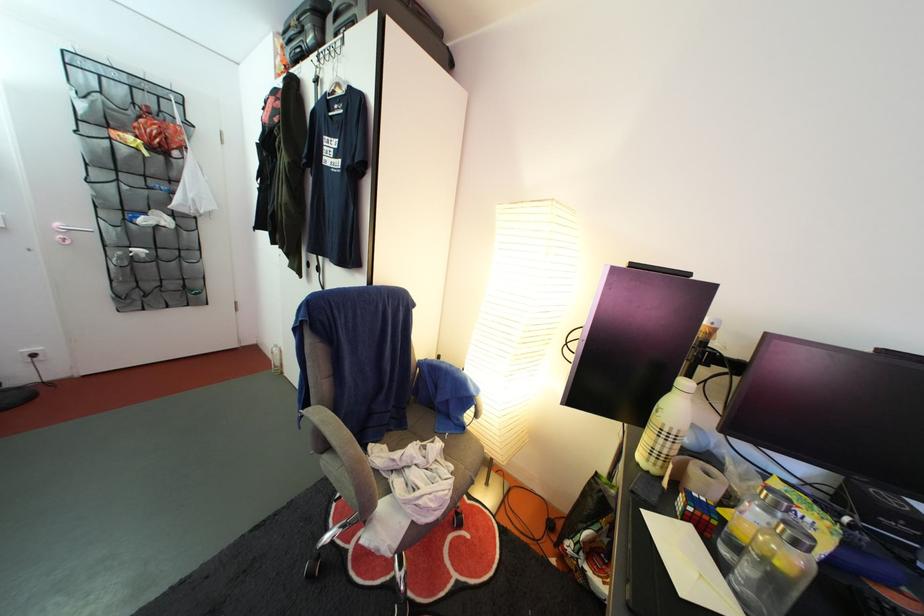
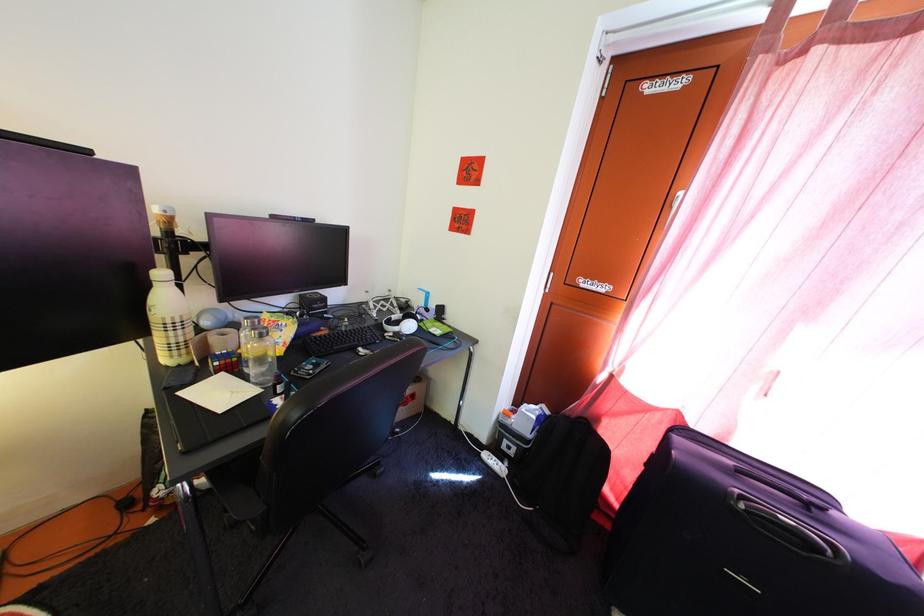
The point at (671, 448) is marked in the first image. Where is the corresponding point in the second image?

(179, 341)